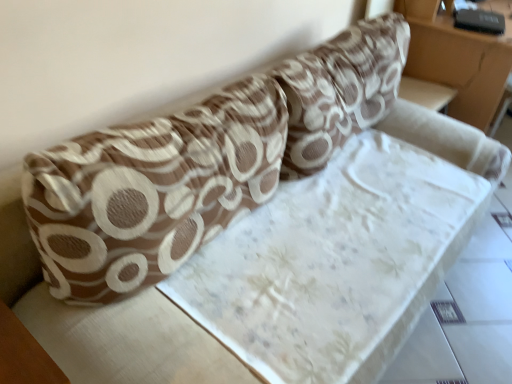
Question: Considering the positions of brown textured pillow at upper center, the 2th throw pillow positioned from the left, and white fabric table at lower left in the image, is brown textured pillow at upper center, the 2th throw pillow positioned from the left, taller or shorter than white fabric table at lower left?

Choices:
 (A) short
 (B) tall

Answer: (B)

Question: From a real-world perspective, is brown textured pillow at upper center, placed as the first throw pillow when sorted from right to left, positioned above or below white fabric table at lower left?

Choices:
 (A) below
 (B) above

Answer: (B)

Question: Estimate the real-world distances between objects in this image. Which object is farther from the brown textured pillow at upper center, which is the first throw pillow in left-to-right order?

Choices:
 (A) floral fabric mattress at upper right
 (B) brown textured pillow at upper center, the 2th throw pillow positioned from the left
 (C) white fabric table at lower left

Answer: (A)

Question: Which of these objects is positioned closest to the brown textured pillow at upper center, placed as the first throw pillow when sorted from right to left?

Choices:
 (A) white fabric table at lower left
 (B) brown textured pillow at upper center, which is the first throw pillow in left-to-right order
 (C) floral fabric mattress at upper right

Answer: (B)